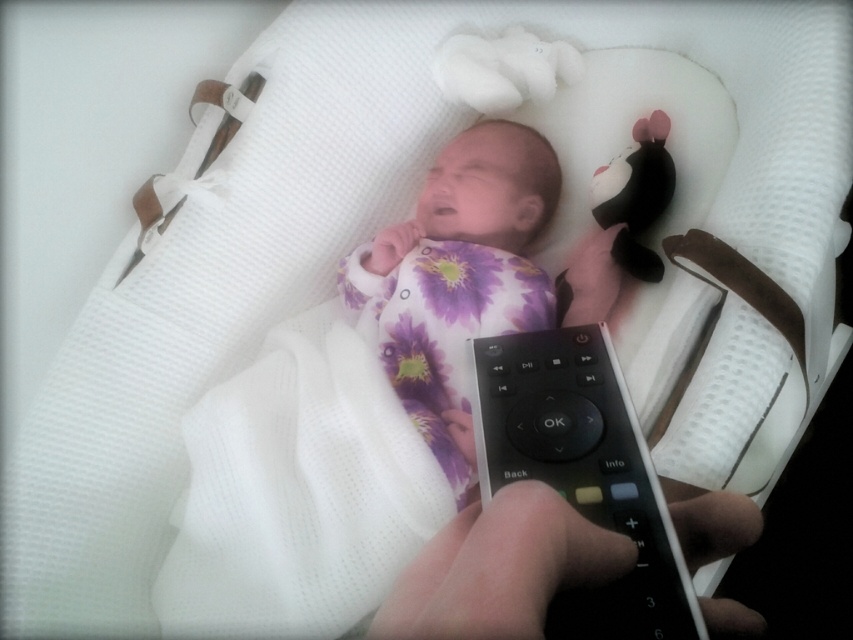
Question: From the image, what is the correct spatial relationship of purple floral fabric newborn at center in relation to black matte remote control at center?

Choices:
 (A) above
 (B) below

Answer: (A)

Question: Based on their relative distances, which object is nearer to the black matte remote control at center?

Choices:
 (A) black plastic remote at center
 (B) purple floral fabric newborn at center

Answer: (A)

Question: Can you confirm if purple floral fabric newborn at center is wider than black plastic remote at center?

Choices:
 (A) no
 (B) yes

Answer: (B)

Question: Which point appears farthest from the camera in this image?

Choices:
 (A) (589, 266)
 (B) (573, 536)

Answer: (A)

Question: Which object is the closest to the black matte remote control at center?

Choices:
 (A) purple floral fabric newborn at center
 (B) black plastic remote at center

Answer: (B)

Question: Is the position of purple floral fabric newborn at center less distant than that of black matte remote control at center?

Choices:
 (A) yes
 (B) no

Answer: (B)